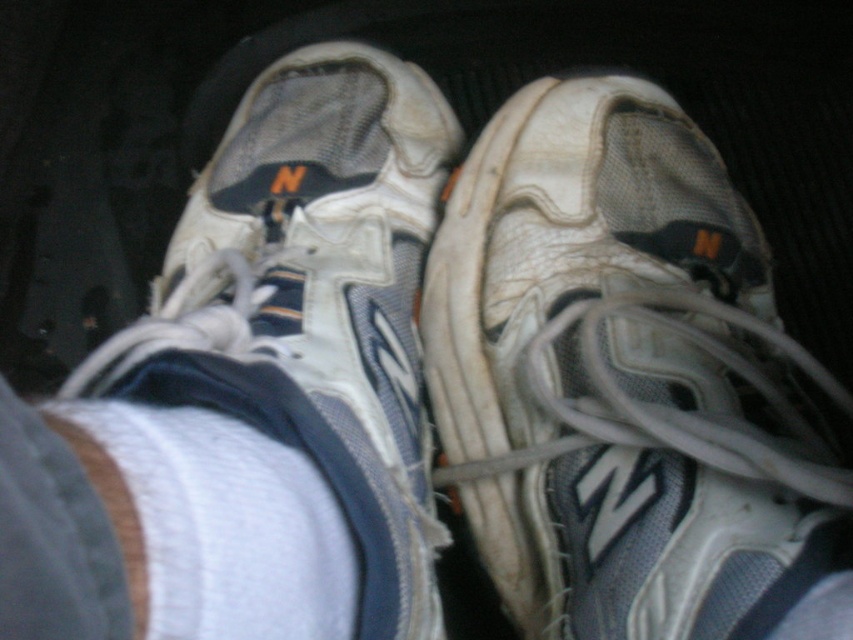
From the picture: You are a delivery person who needs to place a small package between the two white mesh running shoe at center. Can you fit the package if it measures 50 centimeters in length?

The two white mesh running shoe at center are 51.01 centimeters apart, so yes, the package measuring 50 centimeters in length can fit between them.

You are a customer at a shoe store trying to decide between two items displayed on a shelf. The items are the white fabric sock at lower center and the white fabric at lower center. Based on their sizes, which one would you choose if you want the larger option?

The white fabric sock at lower center has a larger size compared to the white fabric at lower center, so you should choose the white fabric sock at lower center if you want the larger option.

You are a delivery driver who just finished a long trip. You notice your shoes and the car floor in the image. Which object, the white mesh running shoe at center or the white fabric at lower center, is wider?

The white mesh running shoe at center is wider than the white fabric at lower center.